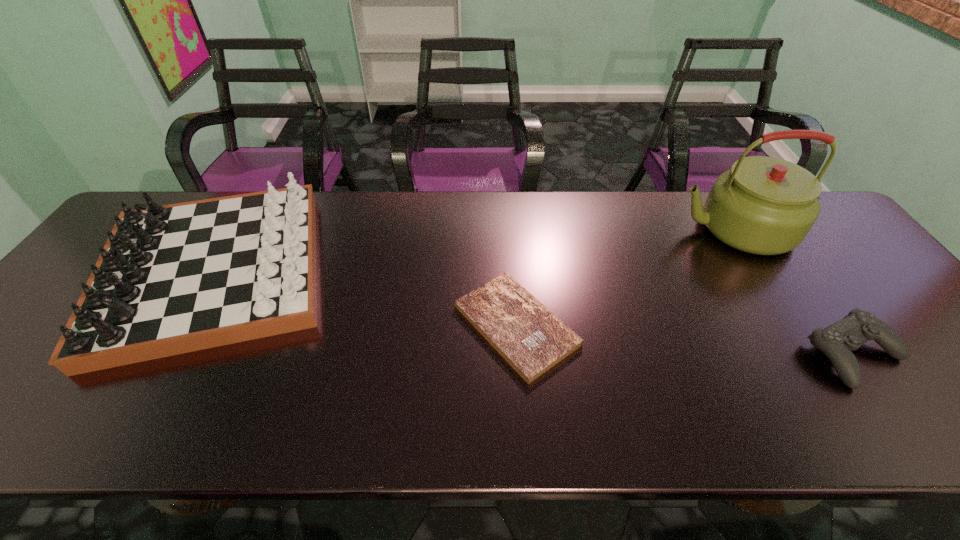
Find the location of `free space at the near edge of the desktop`. free space at the near edge of the desktop is located at coordinates (539, 424).

I want to click on free space at the near left corner of the desktop, so click(10, 412).

Locate an element on the screen. This screenshot has width=960, height=540. vacant space at the far right corner of the desktop is located at coordinates (824, 214).

Where is `empty location between the tallest object and the leftmost object`? empty location between the tallest object and the leftmost object is located at coordinates (474, 251).

Where is `free area in between the Bible and the control`? free area in between the Bible and the control is located at coordinates click(684, 340).

Locate an element on the screen. Image resolution: width=960 pixels, height=540 pixels. vacant point located between the tallest object and the second tallest object is located at coordinates (474, 251).

What are the coordinates of `vacant area between the tallest object and the control` in the screenshot? It's located at (793, 292).

Where is `vacant area between the second object from left to right and the second shortest object`? The image size is (960, 540). vacant area between the second object from left to right and the second shortest object is located at coordinates (684, 340).

You are a GUI agent. You are given a task and a screenshot of the screen. Output one action in this format:
    pyautogui.click(x=<x>, y=<y>)
    Task: Click on the empty space between the kettle and the third shortest object
    This screenshot has width=960, height=540.
    Given the screenshot: What is the action you would take?
    click(474, 251)

Find the location of `vacant space that is in between the tallest object and the control`. vacant space that is in between the tallest object and the control is located at coordinates (793, 292).